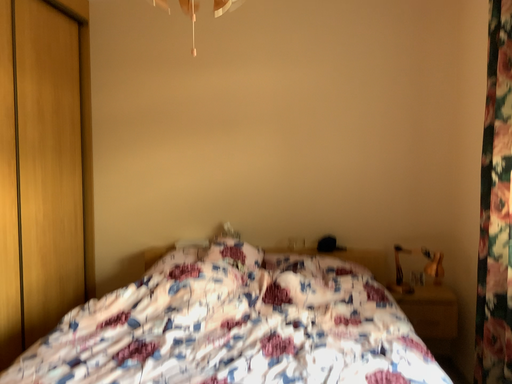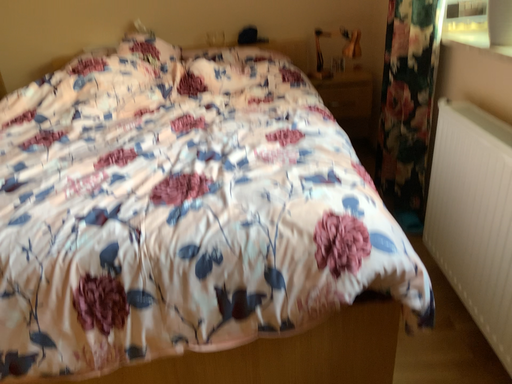
Question: How did the camera likely rotate when shooting the video?

Choices:
 (A) rotated left
 (B) rotated right

Answer: (B)